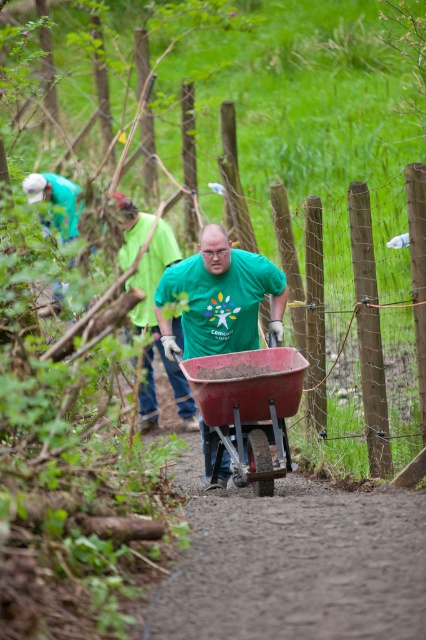
Which is more to the right, matte green shirt at center or green matte shirt at center?

Positioned to the right is matte green shirt at center.

Who is more distant from viewer, [244,333] or [175,250]?

The point [175,250] is more distant.

Is point (184, 268) in front of point (175, 259)?

Yes.

You are a GUI agent. You are given a task and a screenshot of the screen. Output one action in this format:
    pyautogui.click(x=<x>, y=<y>)
    Task: Click on the matte green shirt at center
    
    Given the screenshot: What is the action you would take?
    pyautogui.click(x=219, y=298)

Is matte red wheelbarrow at center positioned at the back of green matte shirt at center?

No, matte red wheelbarrow at center is closer to the viewer.

Does matte red wheelbarrow at center have a larger size compared to green matte shirt at center?

Actually, matte red wheelbarrow at center might be smaller than green matte shirt at center.

Which is behind, point (270, 372) or point (175, 333)?

Point (175, 333)

Locate an element on the screen. This screenshot has height=640, width=426. matte red wheelbarrow at center is located at coordinates (247, 410).

Who is lower down, matte red wheelbarrow at center or matte green shirt at center?

matte red wheelbarrow at center

Who is more forward, [239,449] or [282,324]?

Point [239,449] is in front.

You are a GUI agent. You are given a task and a screenshot of the screen. Output one action in this format:
    pyautogui.click(x=<x>, y=<y>)
    Task: Click on the matte red wheelbarrow at center
    The height and width of the screenshot is (640, 426).
    Given the screenshot: What is the action you would take?
    pyautogui.click(x=247, y=410)